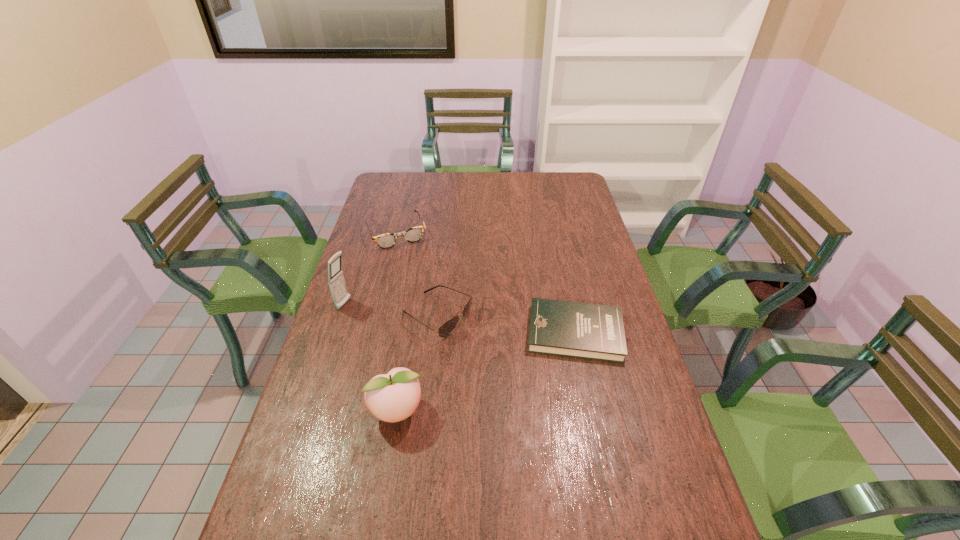
I want to click on peach, so click(392, 397).

This screenshot has width=960, height=540. In order to click on the nearest object in this screenshot , I will do `click(392, 397)`.

Identify the location of book. The width and height of the screenshot is (960, 540). tap(592, 331).

Find the location of a particular element. the shortest object is located at coordinates (592, 331).

Identify the location of sunglasses. This screenshot has width=960, height=540. (447, 328).

You are a GUI agent. You are given a task and a screenshot of the screen. Output one action in this format:
    pyautogui.click(x=<x>, y=<y>)
    Task: Click on the tallest object
    The height and width of the screenshot is (540, 960).
    Given the screenshot: What is the action you would take?
    pyautogui.click(x=336, y=281)

Where is `the farthest object`? the farthest object is located at coordinates (414, 234).

Locate an element on the screen. free location located 0.310m on the back of the peach is located at coordinates (414, 308).

This screenshot has height=540, width=960. Identify the location of free region located 0.370m on the back of the rightmost object. (555, 239).

The width and height of the screenshot is (960, 540). What are the coordinates of `vacant region located on the front-facing side of the sunglasses` in the screenshot? It's located at (561, 380).